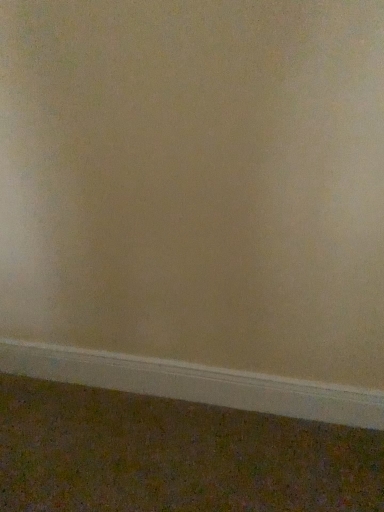
Describe the element at coordinates (195, 383) in the screenshot. I see `white smooth baseboard at lower center` at that location.

Find the location of `white smooth baseboard at lower center`. white smooth baseboard at lower center is located at coordinates (x=195, y=383).

What is the approximate height of white smooth baseboard at lower center?

white smooth baseboard at lower center is 4.74 inches in height.

This screenshot has height=512, width=384. In order to click on white smooth baseboard at lower center in this screenshot , I will do `click(195, 383)`.